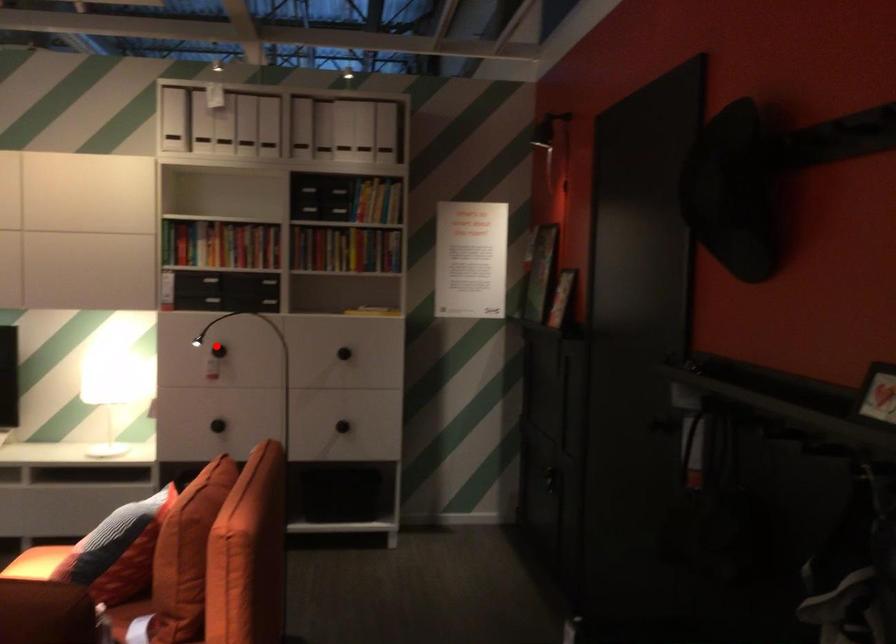
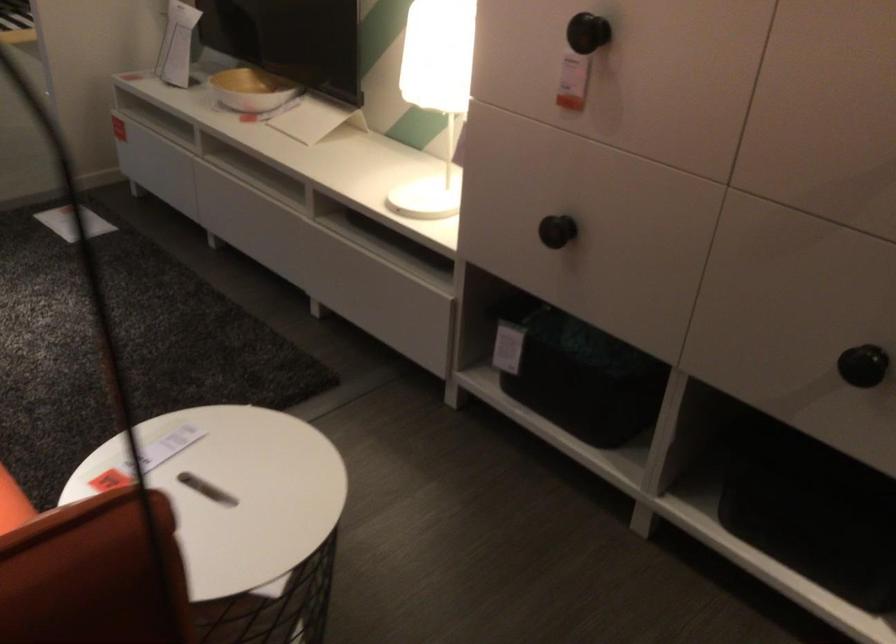
Locate, in the second image, the point that corresponds to the highlighted location in the first image.

(588, 33)